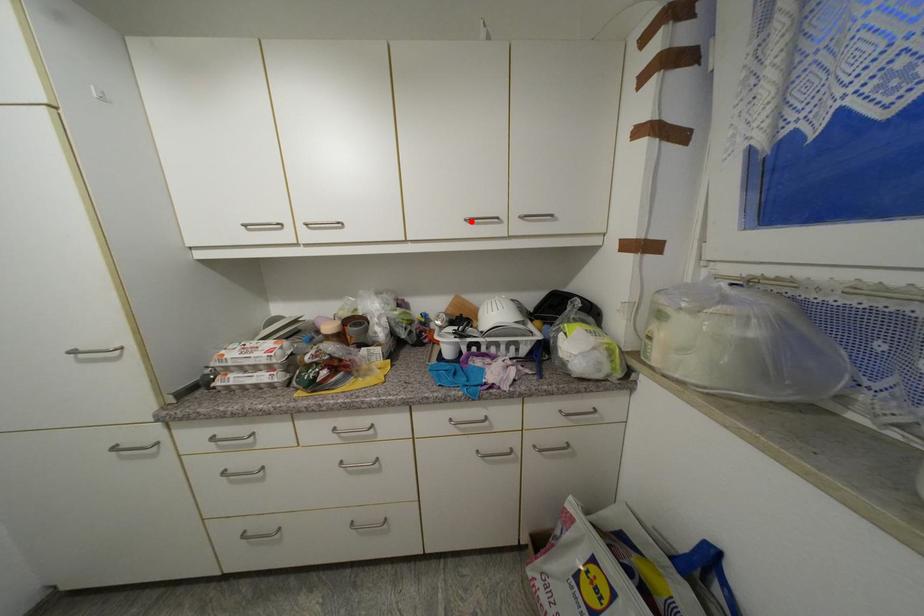
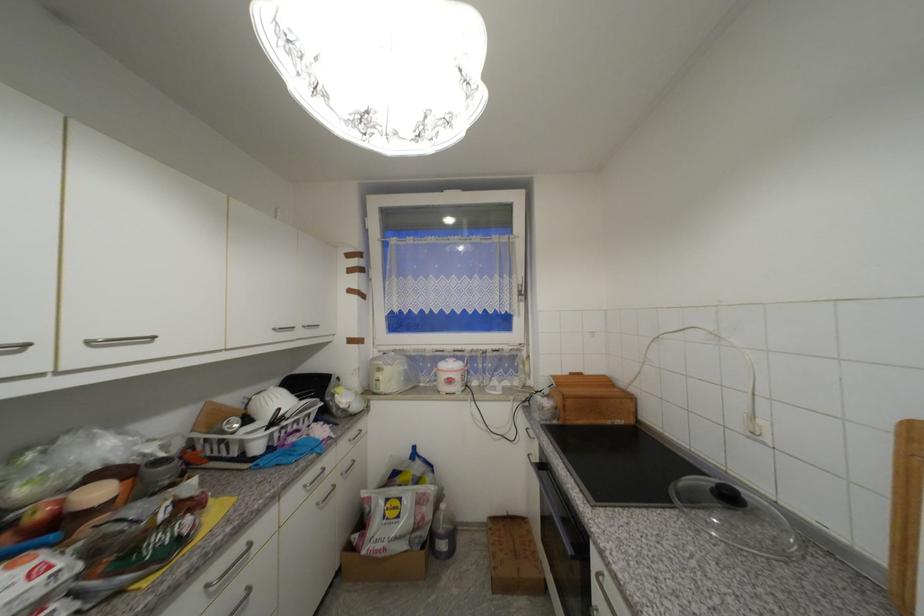
Locate, in the second image, the point that corresponds to the highlighted location in the first image.

(281, 331)